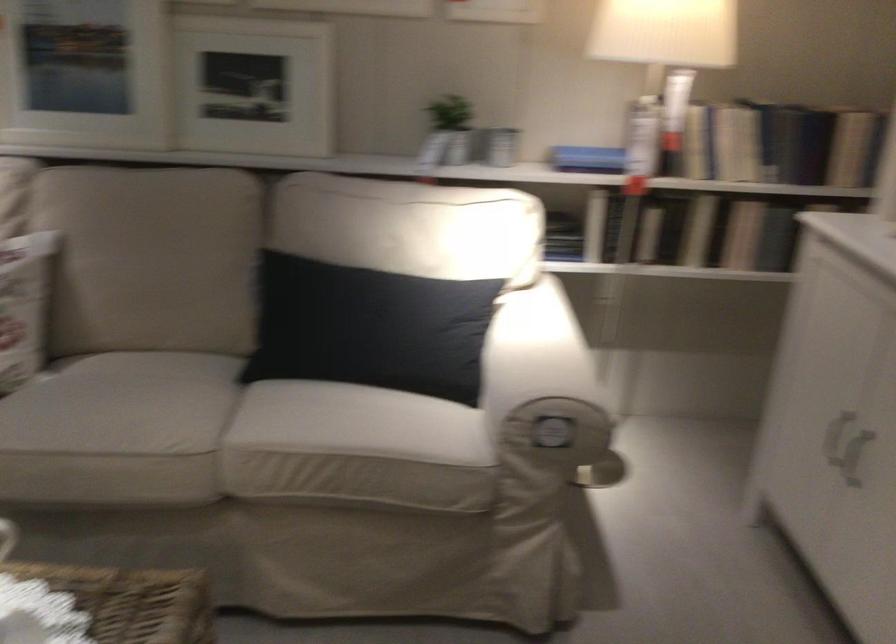
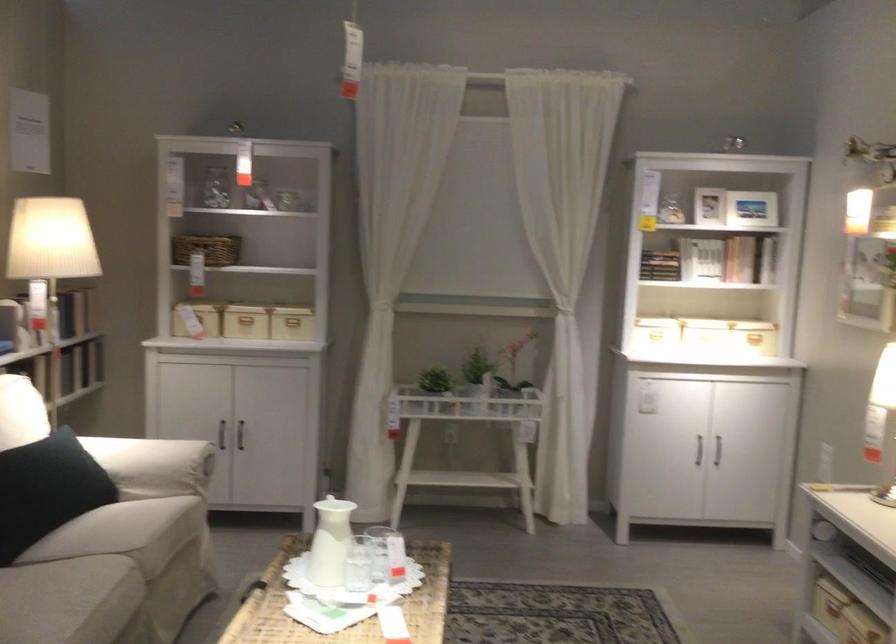
Find the pixel in the second image that matches point (510, 377) in the first image.

(152, 465)